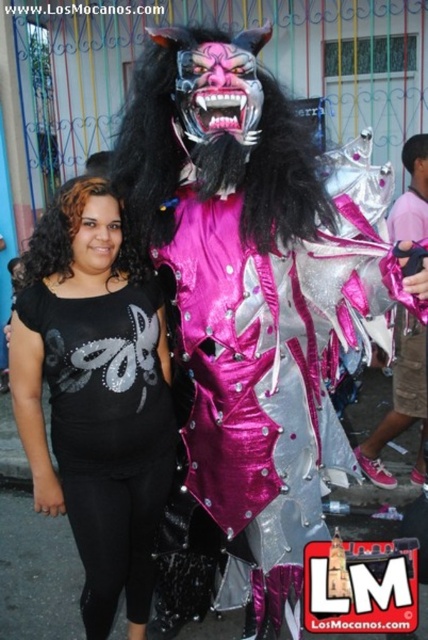
Who is more distant from viewer, (77, 216) or (421, 460)?

The point (421, 460) is behind.

Which of these two, black matte leggings at lower left or shiny silver costume at right, stands shorter?

shiny silver costume at right

The image size is (428, 640). What are the coordinates of `black matte leggings at lower left` in the screenshot? It's located at (95, 396).

What are the coordinates of `black matte leggings at lower left` in the screenshot? It's located at (95, 396).